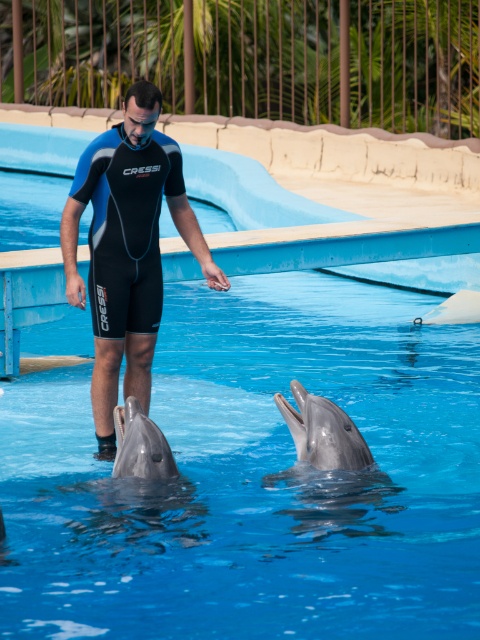
Question: Which object is farther from the camera taking this photo?

Choices:
 (A) black neoprene wetsuit at center
 (B) blue neoprene wetsuit at center
 (C) gray matte dolphin at lower center

Answer: (A)

Question: Which object is positioned farthest from the blue neoprene wetsuit at center?

Choices:
 (A) black neoprene wetsuit at center
 (B) gray matte dolphin at lower center

Answer: (B)

Question: Can you confirm if blue neoprene wetsuit at center is wider than gray matte dolphin at lower center?

Choices:
 (A) yes
 (B) no

Answer: (A)

Question: Estimate the real-world distances between objects in this image. Which object is closer to the gray matte dolphin at lower center?

Choices:
 (A) black neoprene wetsuit at center
 (B) blue neoprene wetsuit at center

Answer: (B)

Question: Can you confirm if black neoprene wetsuit at center is smaller than gray matte dolphin at lower center?

Choices:
 (A) no
 (B) yes

Answer: (A)

Question: Is black neoprene wetsuit at center further to the viewer compared to gray matte dolphin at lower center?

Choices:
 (A) yes
 (B) no

Answer: (A)